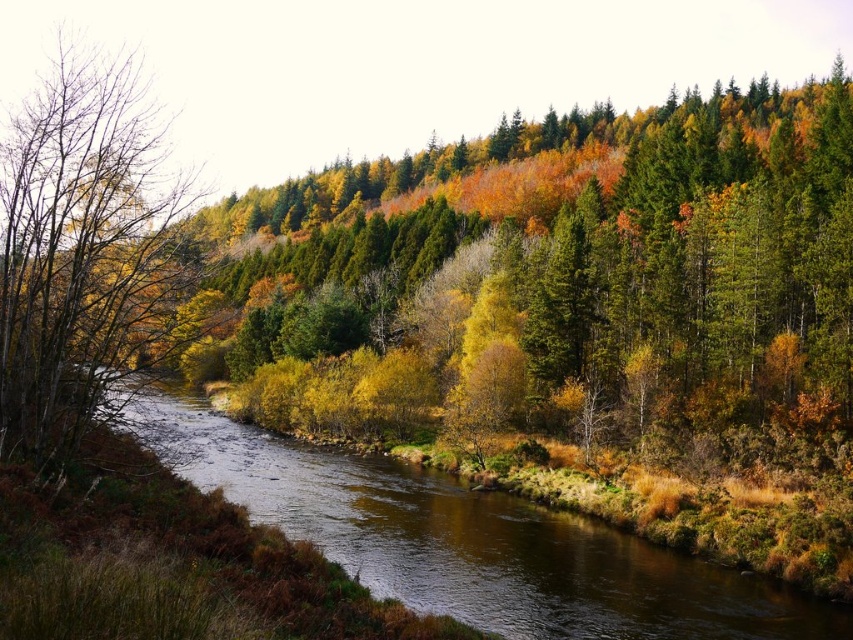
Does point (624, 532) come in front of point (125, 96)?

No, it is behind (125, 96).

Who is positioned more to the right, brown smooth stream at center or brown matte tree at left?

brown smooth stream at center is more to the right.

This screenshot has height=640, width=853. In order to click on brown smooth stream at center in this screenshot , I will do coord(471,541).